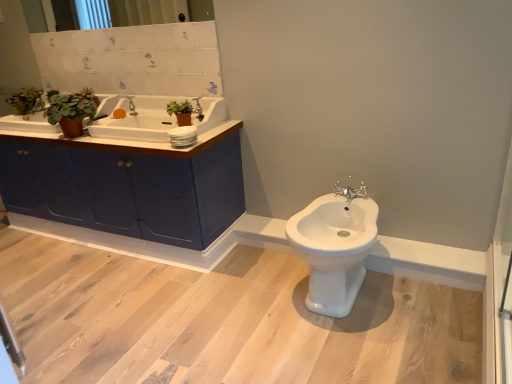
The height and width of the screenshot is (384, 512). I want to click on free point to the right of white glossy bidet at center, so click(x=425, y=304).